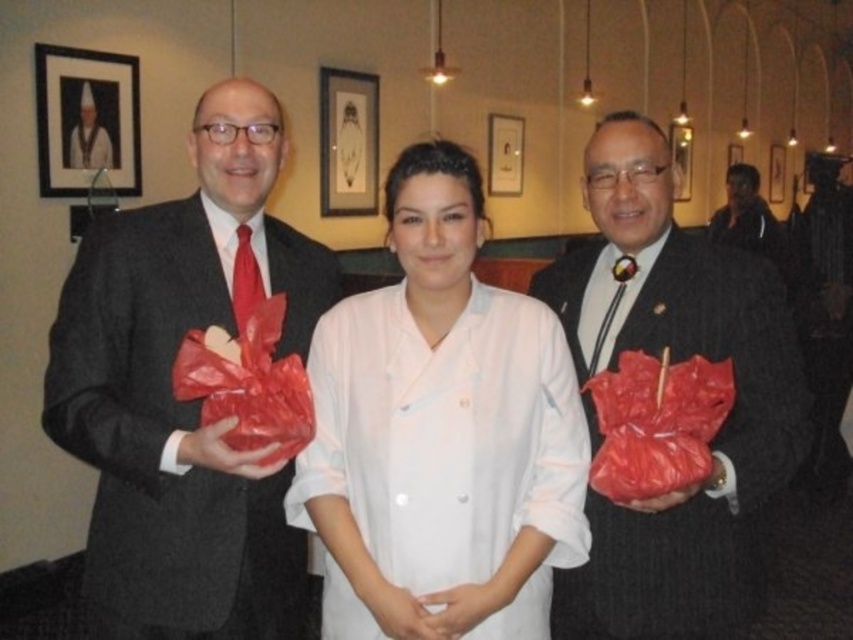
Question: Is white smooth uniform at center in front of matte black suit at right?

Choices:
 (A) yes
 (B) no

Answer: (B)

Question: Estimate the real-world distances between objects in this image. Which object is farther from the black fabric jacket at upper right?

Choices:
 (A) matte black suit at left
 (B) white smooth uniform at center
 (C) matte black suit at right

Answer: (A)

Question: Is matte black suit at left smaller than black fabric jacket at upper right?

Choices:
 (A) no
 (B) yes

Answer: (B)

Question: Which of the following is the farthest from the observer?

Choices:
 (A) (759, 202)
 (B) (434, 497)

Answer: (A)

Question: Can you confirm if white smooth uniform at center is positioned below black fabric jacket at upper right?

Choices:
 (A) no
 (B) yes

Answer: (B)

Question: Which point is farther to the camera?

Choices:
 (A) matte black suit at left
 (B) black fabric jacket at upper right
 (C) matte black suit at right
 (D) white smooth uniform at center

Answer: (B)